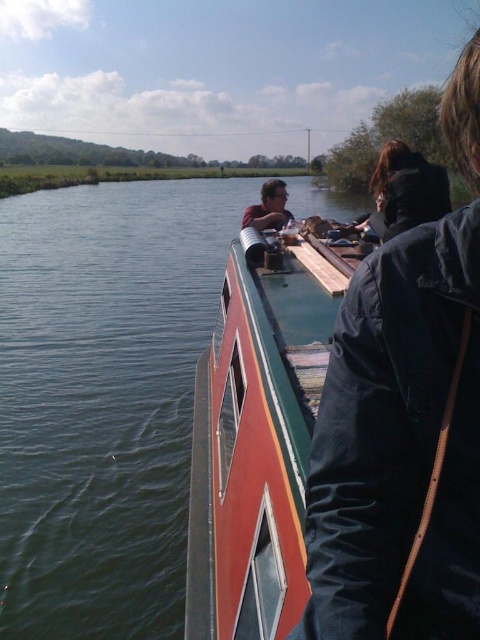
You are a photographer on the narrowboat and want to capture both the dark blue jacket at upper right and the matte black jacket at center in a single shot. Since your camera has a limited zoom range, you need to know which jacket is bigger to adjust the framing. Can you tell me which one is larger?

The dark blue jacket at upper right is larger in size than the matte black jacket at center, so you should frame the shot to accommodate the larger jacket first.